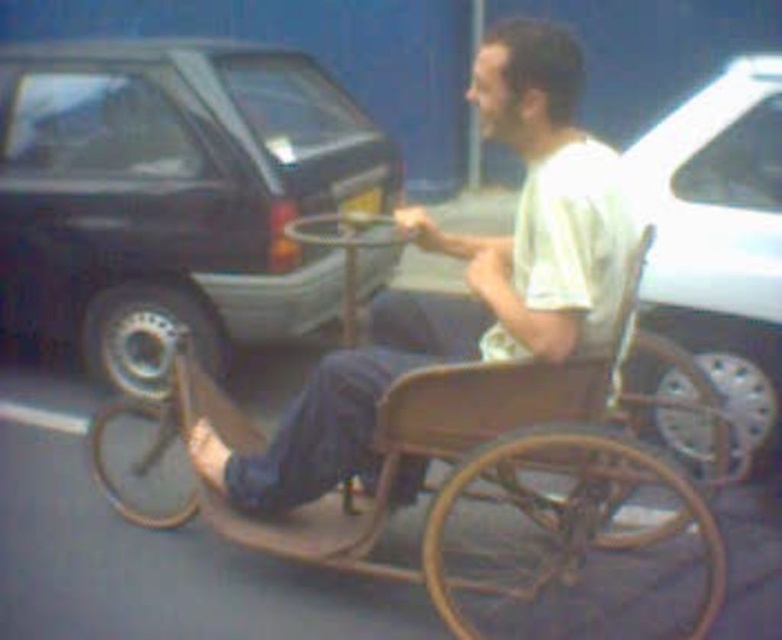
You are navigating a delivery drone that needs to hover above the wooden wheelchair at center. According to the coordinates provided, what are the exact coordinates where the drone should hover?

The drone should hover at the coordinates point (542, 204) where the wooden wheelchair at center is located.

Consider the image. You are a delivery person who needs to move the wooden wheelchair at center and the white glossy car at right to the other side of the street. Based on their positions in the image, which object should you move first to avoid blocking the other?

The wooden wheelchair at center should be moved first because it is positioned below the white glossy car at right, meaning it is closer to the street and would block access to the white glossy car if moved afterward.